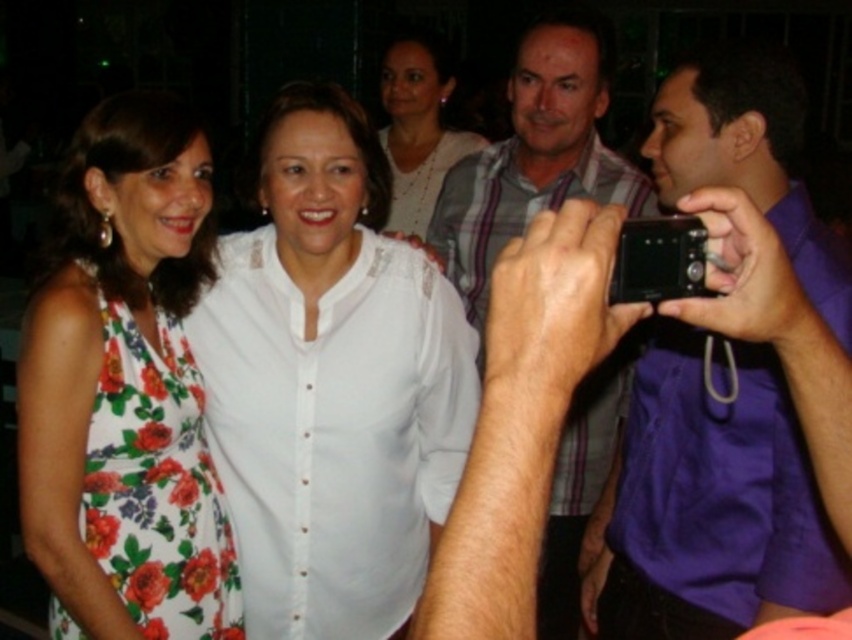
Is floral dress at center in front of striped cotton shirt at center?

Yes, it is in front of striped cotton shirt at center.

Is point (56, 340) in front of point (484, 288)?

Yes.

Does point (131, 429) come closer to viewer compared to point (455, 209)?

Yes, point (131, 429) is closer to viewer.

The height and width of the screenshot is (640, 852). Find the location of `floral dress at center`. floral dress at center is located at coordinates (124, 388).

Which is above, floral dress at center or floral print fabric dress at left?

floral dress at center is higher up.

Is point (59, 337) positioned in front of point (140, 445)?

Yes, point (59, 337) is in front of point (140, 445).

This screenshot has width=852, height=640. Identify the location of floral dress at center. (124, 388).

Is point (445, 422) closer to camera compared to point (125, 330)?

No, (445, 422) is behind (125, 330).

Is white sheer shirt at center above floral print fabric dress at left?

Yes, white sheer shirt at center is above floral print fabric dress at left.

Who is more distant from viewer, [239,458] or [199,566]?

The point [199,566] is behind.

This screenshot has height=640, width=852. Identify the location of white sheer shirt at center. (332, 429).